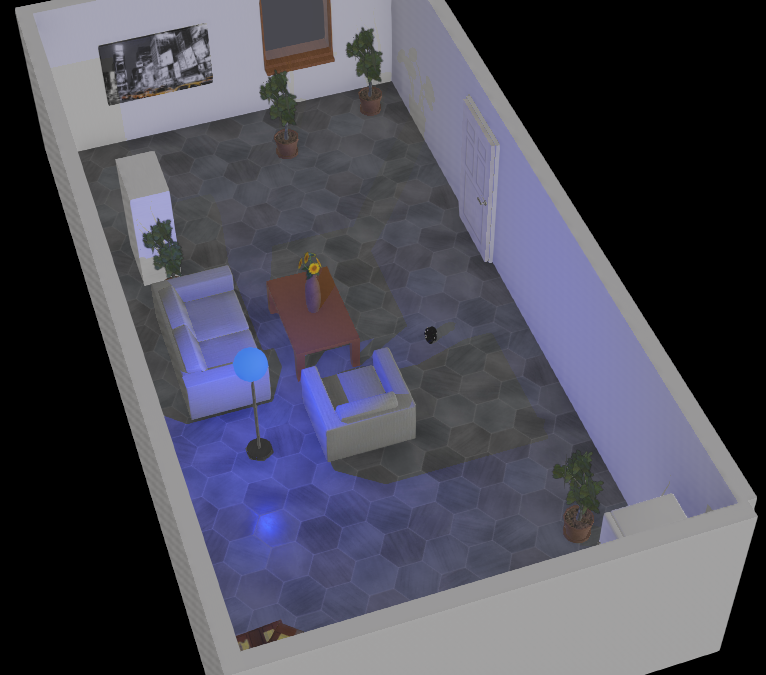
Identify the location of floor. (472, 387).